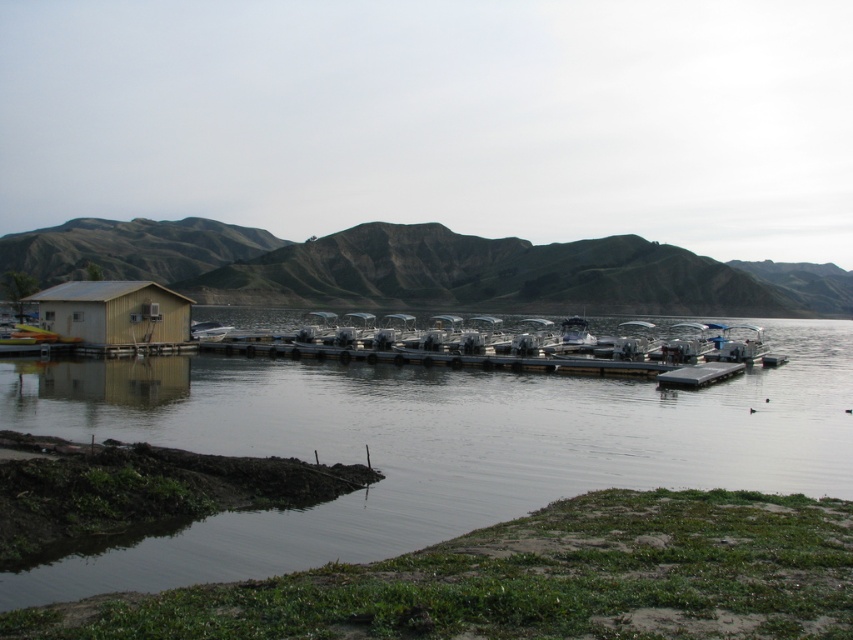
Question: Can you confirm if clear water at lower left is thinner than black rubber dock at center?

Choices:
 (A) no
 (B) yes

Answer: (A)

Question: Does clear water at lower left appear over green textured mountain at upper center?

Choices:
 (A) no
 (B) yes

Answer: (A)

Question: Can you confirm if clear water at lower left is positioned to the left of light brown wooden hut at left?

Choices:
 (A) no
 (B) yes

Answer: (A)

Question: Which object appears farthest from the camera in this image?

Choices:
 (A) green textured mountain at upper center
 (B) light brown wooden hut at left
 (C) clear water at lower left

Answer: (A)

Question: Which object is the closest to the light brown wooden hut at left?

Choices:
 (A) green textured mountain at upper center
 (B) clear water at lower left

Answer: (B)

Question: Which point appears closest to the camera in this image?

Choices:
 (A) (125, 275)
 (B) (695, 369)
 (C) (424, 525)

Answer: (C)